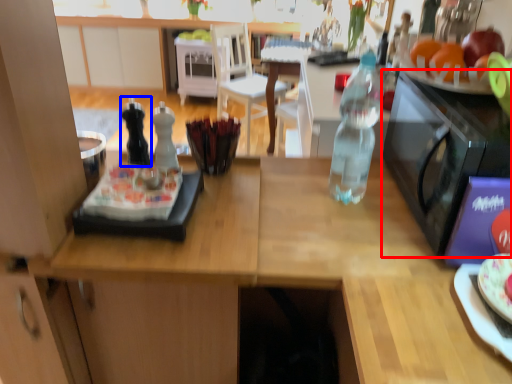
Question: Which of the following is the farthest to the observer, microwave oven (highlighted by a red box) or bottle (highlighted by a blue box)?

Choices:
 (A) microwave oven
 (B) bottle

Answer: (B)